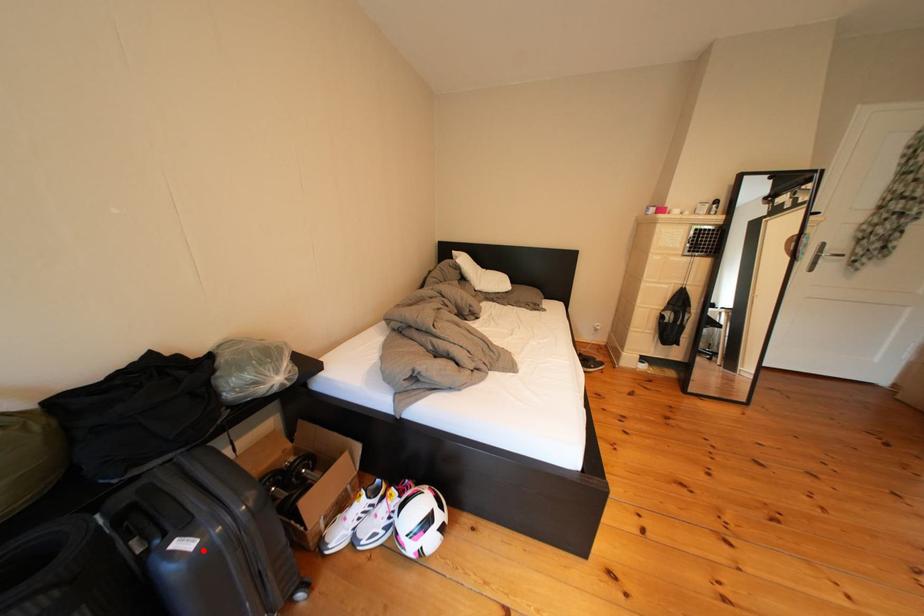
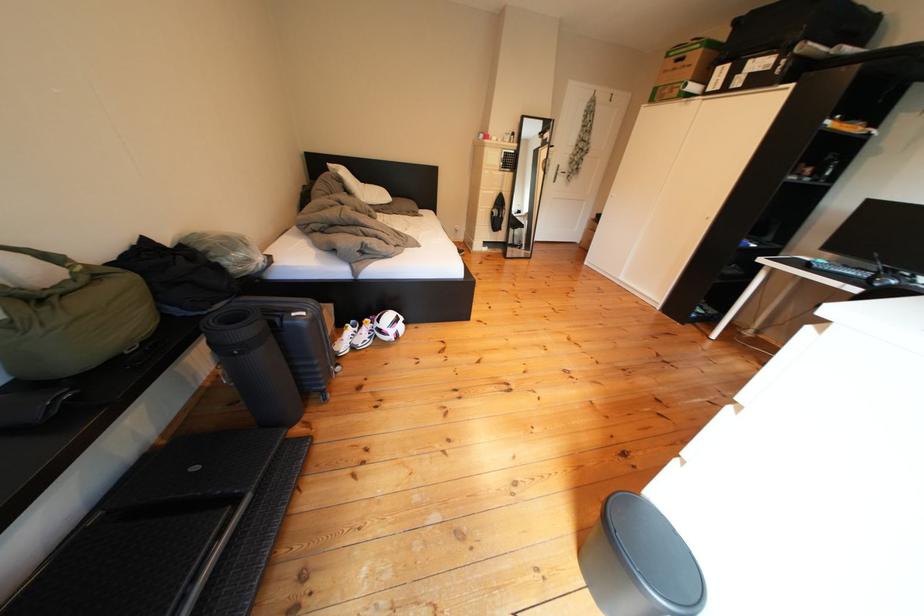
In the second image, find the point that corresponds to the highlighted location in the first image.

(317, 318)